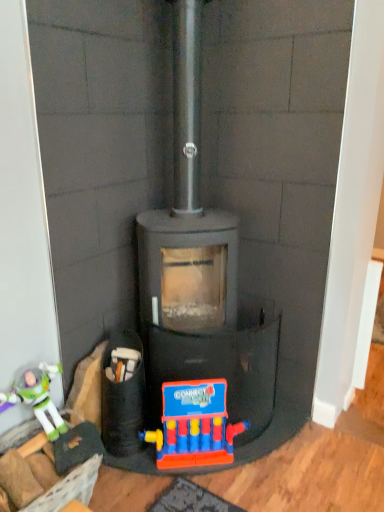
Where is `free space in front of blue plastic connect four at lower center`? free space in front of blue plastic connect four at lower center is located at coordinates (202, 496).